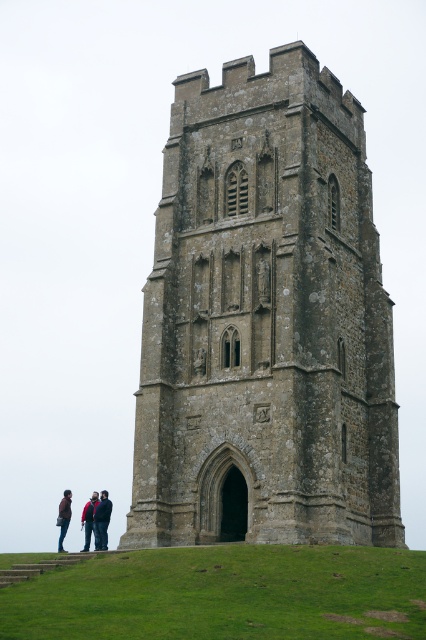
Question: Estimate the real-world distances between objects in this image. Which object is farther from the dark blue jacket at lower left?

Choices:
 (A) dark brown leather jacket at lower left
 (B) stone tower at center
 (C) dark red jacket at lower left
 (D) green grass at lower center

Answer: (D)

Question: Does dark blue jacket at lower left come behind dark brown leather jacket at lower left?

Choices:
 (A) yes
 (B) no

Answer: (B)

Question: Which object appears farthest from the camera in this image?

Choices:
 (A) stone tower at center
 (B) dark blue jacket at lower left
 (C) dark red jacket at lower left
 (D) green grass at lower center

Answer: (C)

Question: Is dark blue jacket at lower left bigger than dark brown leather jacket at lower left?

Choices:
 (A) no
 (B) yes

Answer: (B)

Question: Estimate the real-world distances between objects in this image. Which object is closer to the dark brown leather jacket at lower left?

Choices:
 (A) dark blue jacket at lower left
 (B) dark red jacket at lower left

Answer: (B)

Question: Does green grass at lower center lie in front of dark blue jacket at lower left?

Choices:
 (A) no
 (B) yes

Answer: (B)